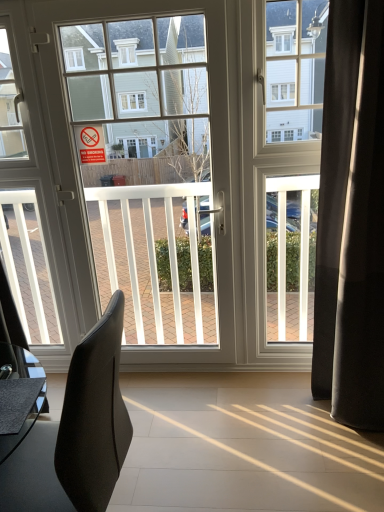
Where is `free space between black fabric curtain at right and white glossy door at center`? free space between black fabric curtain at right and white glossy door at center is located at coordinates (235, 394).